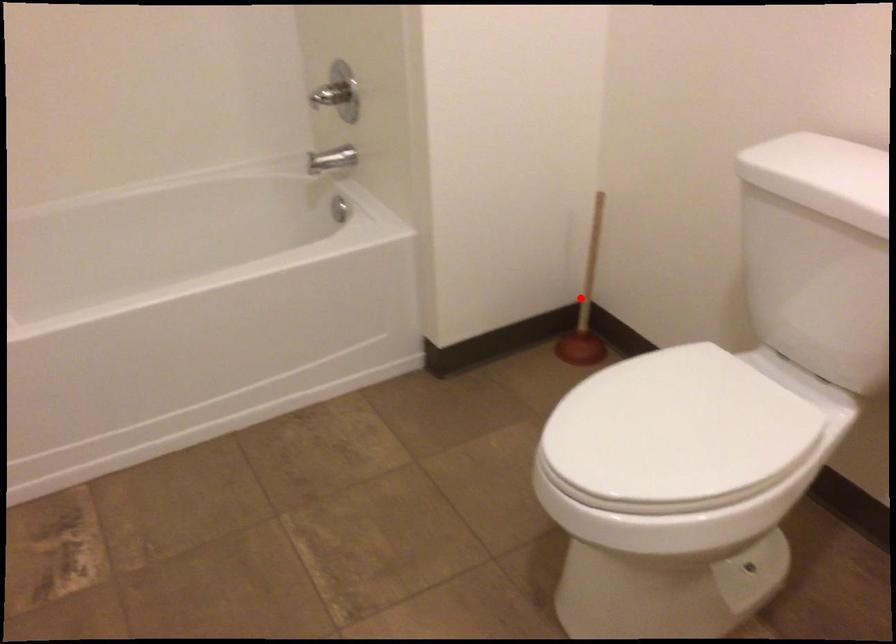
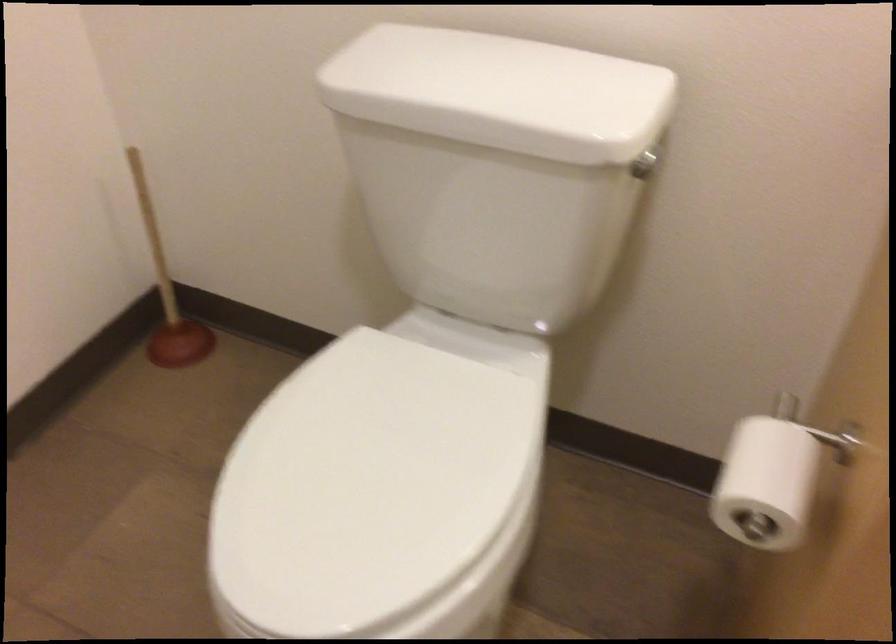
Question: I am providing you with two images of the same scene from different viewpoints. In image1, a red point is highlighted. Considering the same 3D point in image2, which of the following is correct?

Choices:
 (A) It is closer
 (B) It is farther

Answer: (A)